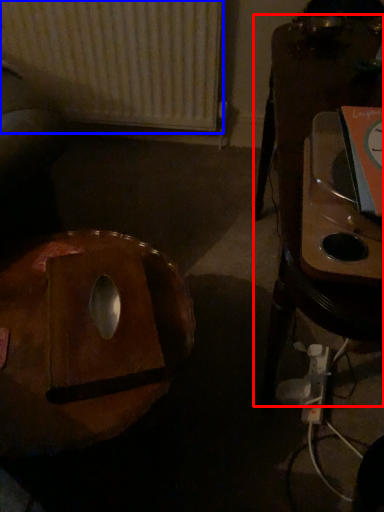
Question: Which point is closer to the camera, furniture (highlighted by a red box) or radiator (highlighted by a blue box)?

Choices:
 (A) furniture
 (B) radiator

Answer: (A)